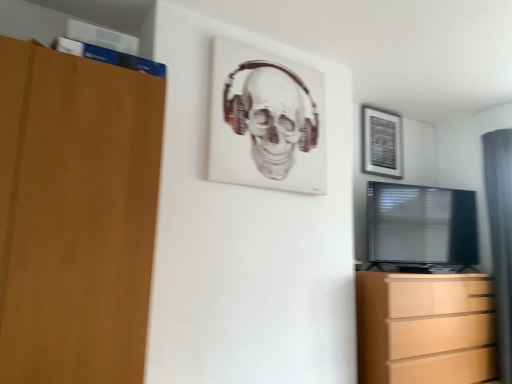
Question: Does white matte picture frame at upper center, which is the 2th picture frame from back to front, have a smaller size compared to light brown wooden chest of drawers at lower right?

Choices:
 (A) no
 (B) yes

Answer: (B)

Question: Does white matte picture frame at upper center, which is the 2th picture frame from back to front, appear on the right side of light brown wooden chest of drawers at lower right?

Choices:
 (A) no
 (B) yes

Answer: (A)

Question: Does white matte picture frame at upper center, the first picture frame positioned from the left, have a lesser width compared to light brown wooden chest of drawers at lower right?

Choices:
 (A) yes
 (B) no

Answer: (A)

Question: Considering the relative sizes of white matte picture frame at upper center, the first picture frame positioned from the left, and light brown wooden chest of drawers at lower right in the image provided, is white matte picture frame at upper center, the first picture frame positioned from the left, bigger than light brown wooden chest of drawers at lower right?

Choices:
 (A) no
 (B) yes

Answer: (A)

Question: Is white matte picture frame at upper center, which is the 2th picture frame from back to front, directly adjacent to light brown wooden chest of drawers at lower right?

Choices:
 (A) no
 (B) yes

Answer: (A)

Question: Is white matte picture frame at upper center, the first picture frame positioned from the front, far away from light brown wooden chest of drawers at lower right?

Choices:
 (A) yes
 (B) no

Answer: (A)

Question: From the image's perspective, is gray fabric curtain at right over black glossy tv at right?

Choices:
 (A) yes
 (B) no

Answer: (B)

Question: Does gray fabric curtain at right lie behind black glossy tv at right?

Choices:
 (A) no
 (B) yes

Answer: (A)

Question: Are gray fabric curtain at right and black glossy tv at right far apart?

Choices:
 (A) yes
 (B) no

Answer: (B)

Question: Can you confirm if gray fabric curtain at right is positioned to the right of black glossy tv at right?

Choices:
 (A) no
 (B) yes

Answer: (B)

Question: Could you tell me if gray fabric curtain at right is turned towards black glossy tv at right?

Choices:
 (A) no
 (B) yes

Answer: (A)

Question: Considering the relative sizes of gray fabric curtain at right and black glossy tv at right in the image provided, is gray fabric curtain at right smaller than black glossy tv at right?

Choices:
 (A) yes
 (B) no

Answer: (B)

Question: Considering the relative sizes of gray fabric curtain at right and matte black picture frame at upper right, the first picture frame viewed from the back, in the image provided, is gray fabric curtain at right thinner than matte black picture frame at upper right, the first picture frame viewed from the back,?

Choices:
 (A) no
 (B) yes

Answer: (A)